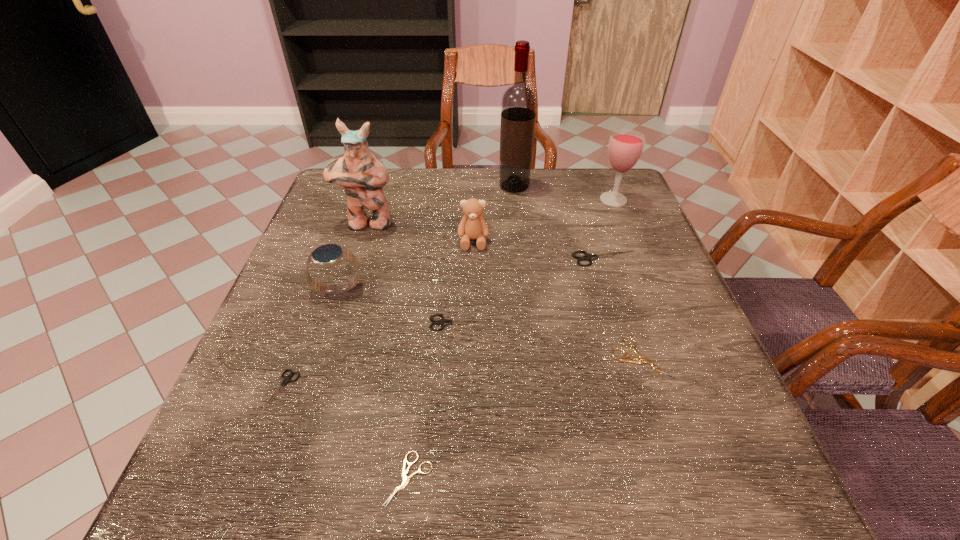
The height and width of the screenshot is (540, 960). I want to click on the second nearest black shears, so click(x=443, y=322).

You are a GUI agent. You are given a task and a screenshot of the screen. Output one action in this format:
    pyautogui.click(x=<x>, y=<y>)
    Task: Click on the fourth shortest shears
    The image size is (960, 540).
    Given the screenshot: What is the action you would take?
    pyautogui.click(x=443, y=322)

The width and height of the screenshot is (960, 540). I want to click on the right beige shears, so click(x=642, y=359).

This screenshot has height=540, width=960. What are the coordinates of `the bigger beige shears` in the screenshot? It's located at (642, 359).

Where is `the nearest black shears`? the nearest black shears is located at coordinates (287, 379).

The width and height of the screenshot is (960, 540). Identify the location of the smallest black shears. (287, 379).

The image size is (960, 540). In order to click on the nearest object in this screenshot , I will do `click(405, 479)`.

The width and height of the screenshot is (960, 540). Find the location of `the left beige shears`. the left beige shears is located at coordinates (405, 479).

The height and width of the screenshot is (540, 960). What are the coordinates of `vacant space situated on the left of the fourth object from right to left` in the screenshot? It's located at (372, 186).

The image size is (960, 540). In order to click on vacant space situated 0.050m on the front-facing side of the pink figurine in this screenshot , I will do `click(360, 246)`.